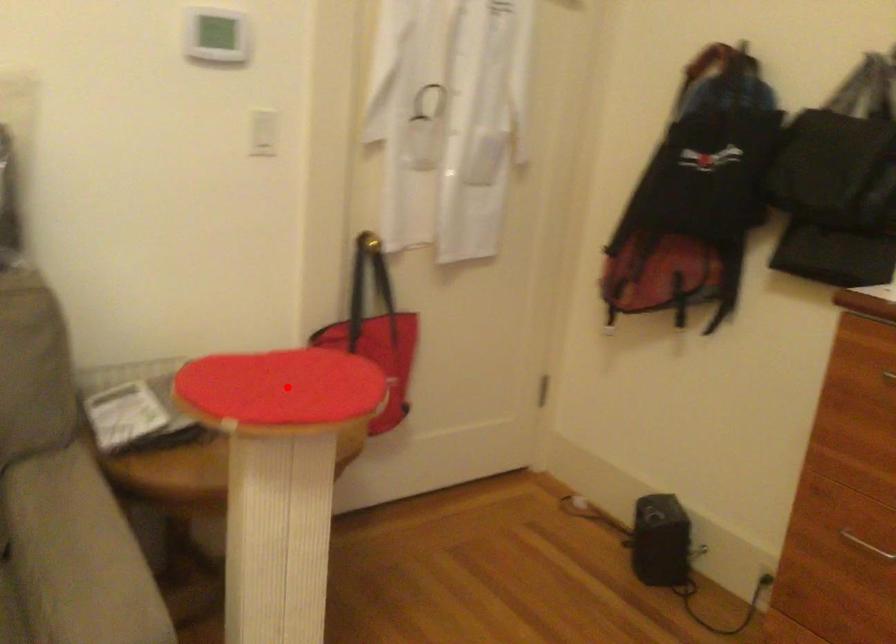
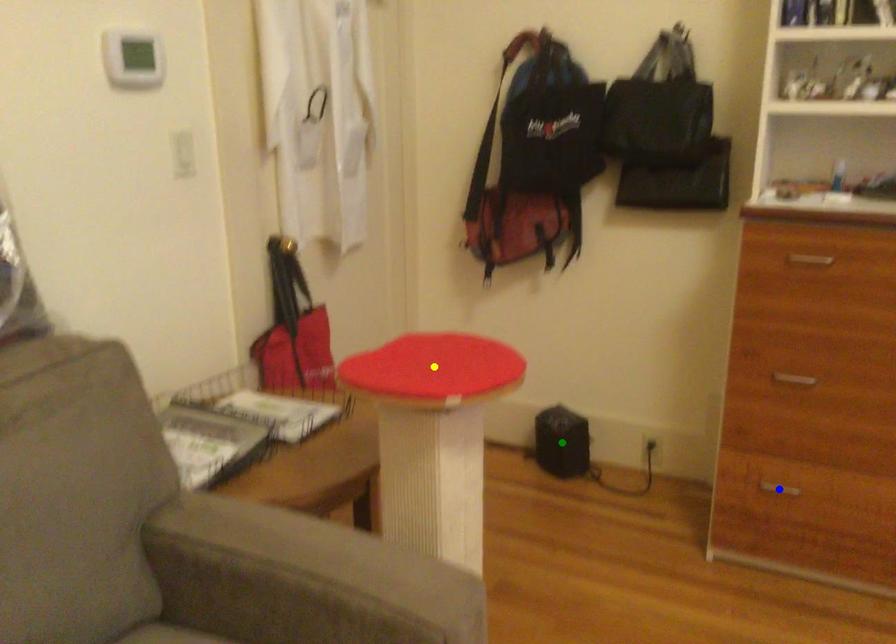
Question: I am providing you with two images of the same scene from different viewpoints. A red point is marked on the first image. You are given multiple points on the second image. Can you choose the point in image 2 that corresponds to the point in image 1?

Choices:
 (A) yellow point
 (B) green point
 (C) blue point

Answer: (A)